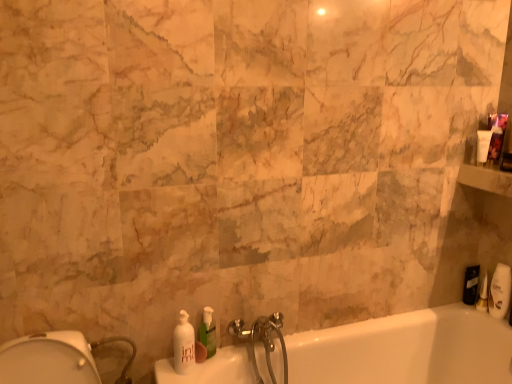
Question: From a real-world perspective, is black matte toiletry at right, which appears as the 2th toiletry when viewed from the front, beneath silver metallic faucet at lower center?

Choices:
 (A) yes
 (B) no

Answer: (B)

Question: Is black matte toiletry at right, which appears as the 2th toiletry when viewed from the front, located outside silver metallic faucet at lower center?

Choices:
 (A) no
 (B) yes

Answer: (B)

Question: Is black matte toiletry at right, which is counted as the 1th toiletry, starting from the back, next to silver metallic faucet at lower center?

Choices:
 (A) yes
 (B) no

Answer: (B)

Question: Considering the relative sizes of black matte toiletry at right, which appears as the 2th toiletry when viewed from the front, and silver metallic faucet at lower center in the image provided, is black matte toiletry at right, which appears as the 2th toiletry when viewed from the front, shorter than silver metallic faucet at lower center?

Choices:
 (A) yes
 (B) no

Answer: (A)

Question: Is black matte toiletry at right, which is counted as the 1th toiletry, starting from the back, to the left of silver metallic faucet at lower center from the viewer's perspective?

Choices:
 (A) no
 (B) yes

Answer: (A)

Question: Is silver metallic faucet at lower center located within black matte toiletry at right, which appears as the 2th toiletry when viewed from the front?

Choices:
 (A) yes
 (B) no

Answer: (B)

Question: From the image's perspective, does green translucent soap dispenser at lower center, which ranks as the first soap dispenser in right-to-left order, appear lower than black matte toiletry at right, which appears as the 2th toiletry when viewed from the front?

Choices:
 (A) no
 (B) yes

Answer: (B)

Question: Are green translucent soap dispenser at lower center, which ranks as the first soap dispenser in right-to-left order, and black matte toiletry at right, which appears as the 2th toiletry when viewed from the front, located far from each other?

Choices:
 (A) no
 (B) yes

Answer: (B)

Question: Is the depth of green translucent soap dispenser at lower center, the 2th soap dispenser when ordered from left to right, greater than that of black matte toiletry at right, which appears as the 2th toiletry when viewed from the front?

Choices:
 (A) no
 (B) yes

Answer: (A)

Question: Can you confirm if green translucent soap dispenser at lower center, the 2th soap dispenser when ordered from left to right, is positioned to the left of black matte toiletry at right, which appears as the 2th toiletry when viewed from the front?

Choices:
 (A) no
 (B) yes

Answer: (B)

Question: Can you confirm if green translucent soap dispenser at lower center, the 2th soap dispenser when ordered from left to right, is smaller than black matte toiletry at right, which is counted as the 1th toiletry, starting from the back?

Choices:
 (A) yes
 (B) no

Answer: (B)

Question: Does green translucent soap dispenser at lower center, the 2th soap dispenser when ordered from left to right, have a greater height compared to black matte toiletry at right, which appears as the 2th toiletry when viewed from the front?

Choices:
 (A) no
 (B) yes

Answer: (B)

Question: Can you confirm if white glossy soap dispenser at lower left, positioned as the 1th soap dispenser in left-to-right order, is bigger than black matte toiletry at right, which is counted as the 1th toiletry, starting from the back?

Choices:
 (A) yes
 (B) no

Answer: (A)